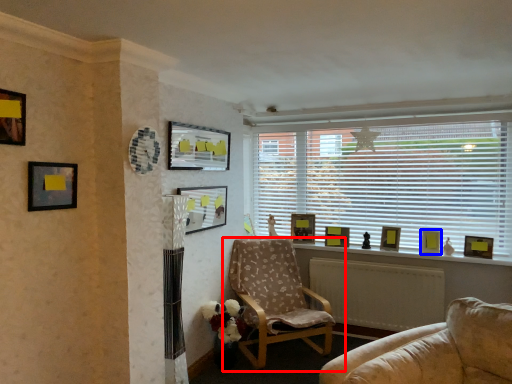
Question: Which object appears farthest to the camera in this image, chair (highlighted by a red box) or picture frame (highlighted by a blue box)?

Choices:
 (A) chair
 (B) picture frame

Answer: (B)